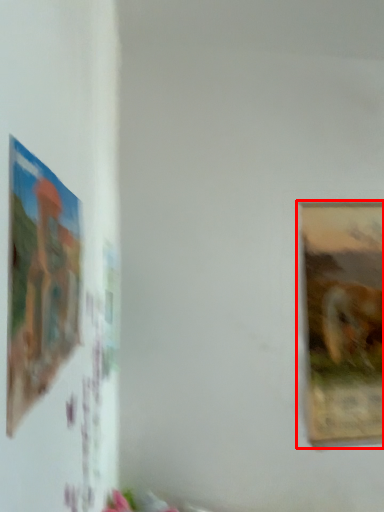
Question: Observing the image, what is the correct spatial positioning of picture frame (annotated by the red box) in reference to picture frame?

Choices:
 (A) right
 (B) left

Answer: (A)